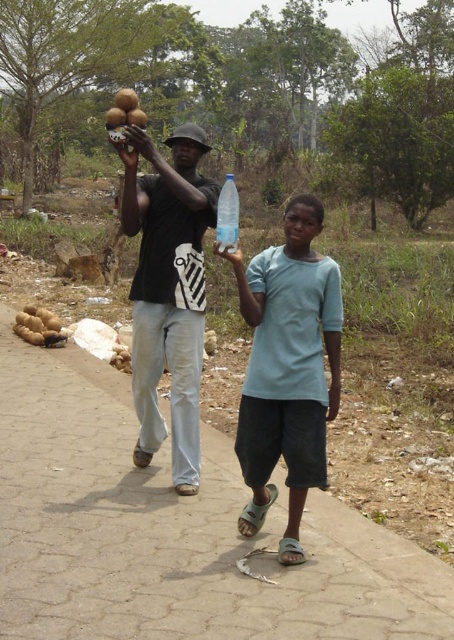
Looking at this image, you are a delivery robot with a width of 0.8 meters. You need to navigate along the paved concrete sidewalk at center while avoiding the matte black coconut at left. Can you safely pass through the sidewalk without hitting the coconut?

The paved concrete sidewalk at center is wider than the matte black coconut at left, so the delivery robot with a width of 0.8 meters can safely pass through the sidewalk without hitting the coconut.

You are a photographer trying to capture a photo of the black matte shirt at center and the transparent plastic bottle at center. If you want to ensure both are fully visible in the frame, which object should you focus on first to avoid blurring due to their height difference?

The black matte shirt at center is taller than the transparent plastic bottle at center, so you should focus on the black matte shirt at center first to ensure proper focus on the taller object before adjusting for the shorter one.